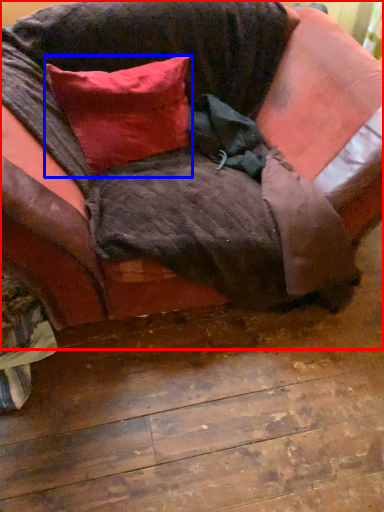
Question: Among these objects, which one is nearest to the camera, studio couch (highlighted by a red box) or pillow (highlighted by a blue box)?

Choices:
 (A) studio couch
 (B) pillow

Answer: (A)